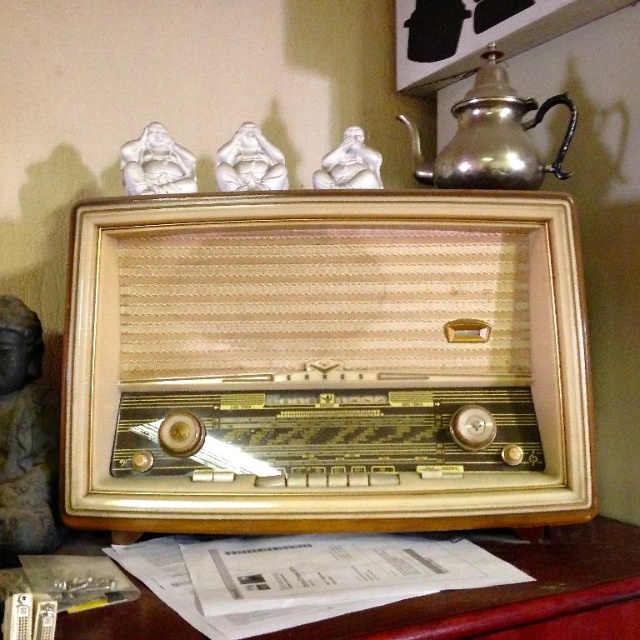
You are standing in front of the vintage radio and want to know the distance to a specific point marked as point (576, 552). Can you determine how far this point is from your current position?

The point (576, 552) is 30.07 inches from the camera, so the distance from your current position to this point is approximately 30.07 inches.

You are arranging items on a shelf and see the gray stone statue at left and the shiny metallic teapot at upper right. Which item is positioned to the left of the other?

The gray stone statue at left is positioned to the left of the shiny metallic teapot at upper right.